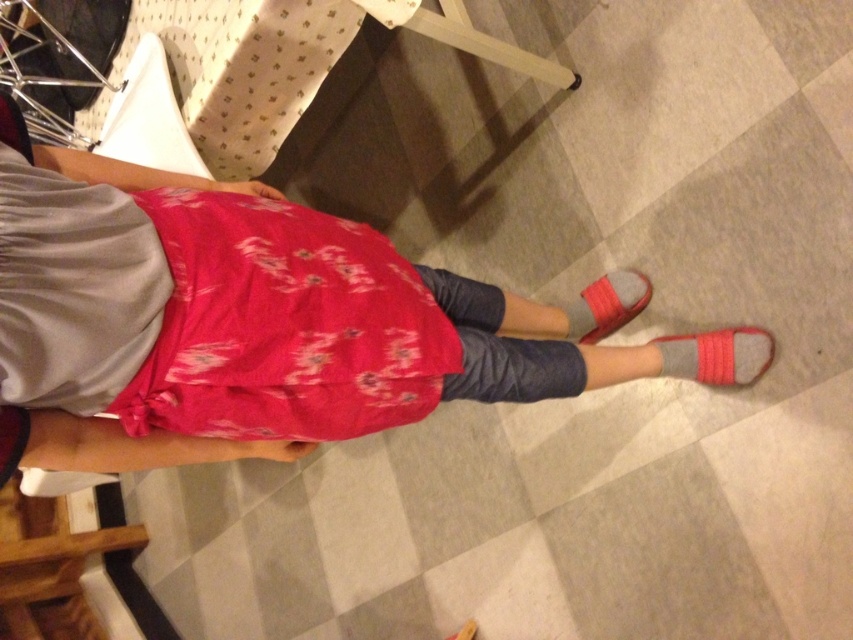
Question: Considering the real-world distances, which object is closest to the gray suede sock at lower right?

Choices:
 (A) floral fabric skirt at center
 (B) gray suede sandal at lower right

Answer: (B)

Question: Which object is the closest to the gray suede sandal at lower right?

Choices:
 (A) floral fabric skirt at center
 (B) gray suede sock at lower right

Answer: (B)

Question: Is floral fabric skirt at center above gray suede sock at lower right?

Choices:
 (A) yes
 (B) no

Answer: (A)

Question: Does gray suede sock at lower right appear over gray suede sandal at lower right?

Choices:
 (A) yes
 (B) no

Answer: (B)

Question: Is floral fabric skirt at center to the right of gray suede sock at lower right from the viewer's perspective?

Choices:
 (A) no
 (B) yes

Answer: (A)

Question: Among these objects, which one is farthest from the camera?

Choices:
 (A) gray suede sock at lower right
 (B) gray suede sandal at lower right

Answer: (B)